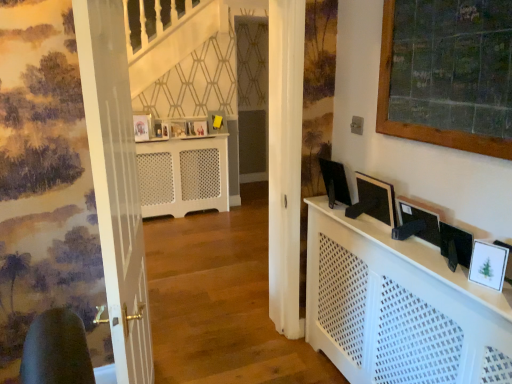
Locate an element on the screen. Image resolution: width=512 pixels, height=384 pixels. vacant area situated to the left side of matte black monitor at right, positioned as the 2th computer monitor in left-to-right order is located at coordinates (355, 218).